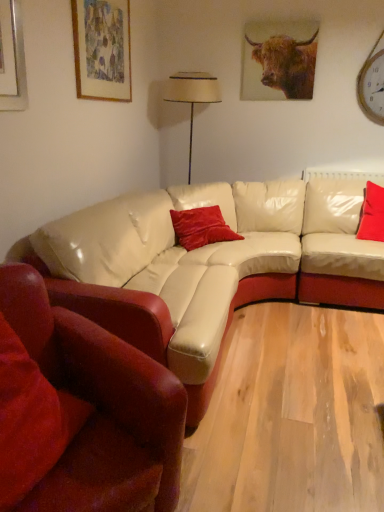
Where is `free space above brown textured bull at upper center (from a real-world perspective)`? free space above brown textured bull at upper center (from a real-world perspective) is located at coordinates (292, 16).